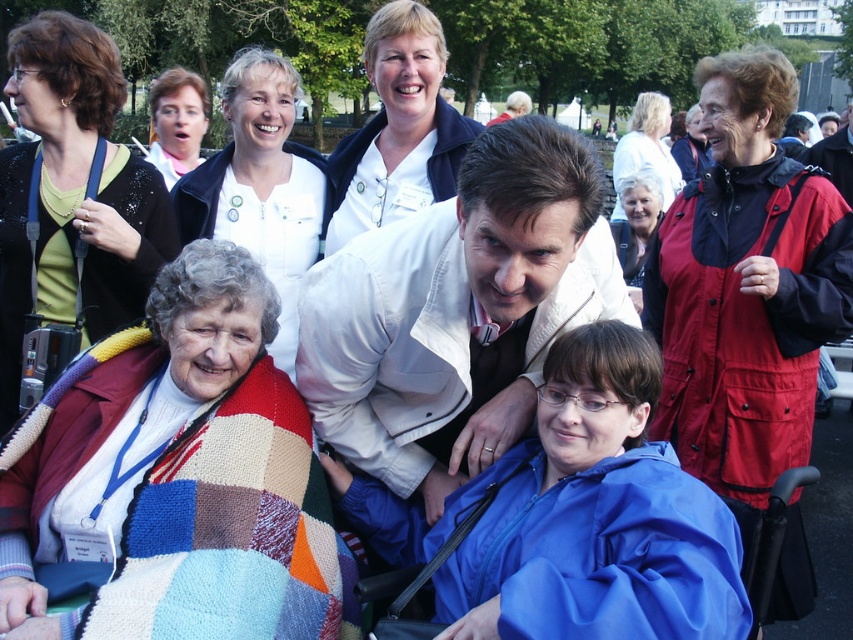
Question: Can you confirm if white matte jacket at center is positioned above matte white blouse at upper left?

Choices:
 (A) no
 (B) yes

Answer: (A)

Question: From the image, what is the correct spatial relationship of white matte jacket at upper center in relation to white textured sweater at upper right?

Choices:
 (A) above
 (B) below

Answer: (B)

Question: Estimate the real-world distances between objects in this image. Which object is closer to the matte white blouse at upper left?

Choices:
 (A) blue matte jacket at center
 (B) white matte jacket at center
 (C) white smooth shirt at upper center

Answer: (C)

Question: Does knitted blanket at lower left have a smaller size compared to matte white blouse at upper left?

Choices:
 (A) no
 (B) yes

Answer: (B)

Question: Which of the following is the farthest from the observer?

Choices:
 (A) knitted blanket at lower left
 (B) matte black sweater at upper left

Answer: (B)

Question: Among these objects, which one is farthest from the camera?

Choices:
 (A) knitted blanket at lower left
 (B) white matte jacket at upper center
 (C) white matte jacket at center
 (D) white textured sweater at upper right

Answer: (D)